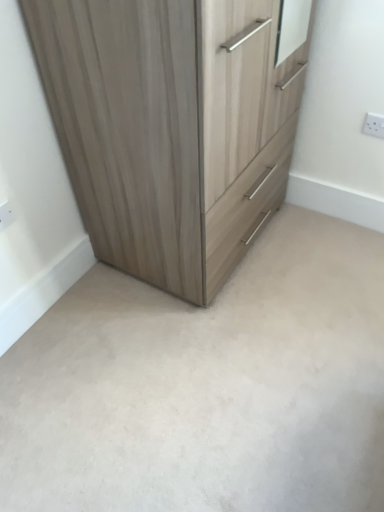
The image size is (384, 512). In order to click on free space in front of light wood/texture chest of drawers at upper left in this screenshot , I will do `click(201, 357)`.